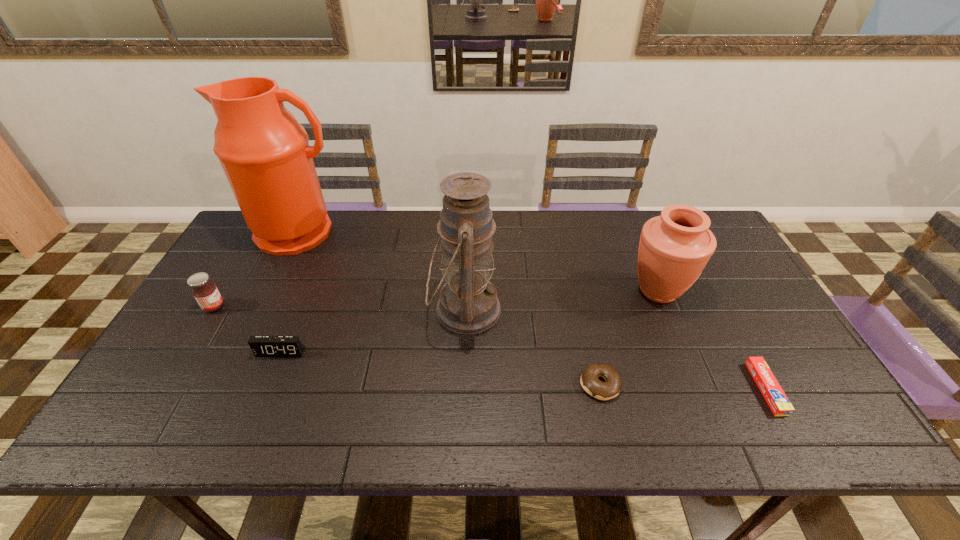
Where is `water jug located at the left edge`? water jug located at the left edge is located at coordinates (264, 152).

Find the location of a particular element. This screenshot has height=540, width=960. jam located in the left edge section of the desktop is located at coordinates (x=205, y=292).

The width and height of the screenshot is (960, 540). In order to click on object that is at the right edge in this screenshot , I will do `click(774, 395)`.

Find the location of a particular element. object located in the far left corner section of the desktop is located at coordinates (264, 152).

You are a GUI agent. You are given a task and a screenshot of the screen. Output one action in this format:
    pyautogui.click(x=<x>, y=<y>)
    Task: Click on the object that is at the near right corner
    The image size is (960, 540).
    Given the screenshot: What is the action you would take?
    pyautogui.click(x=774, y=395)

This screenshot has height=540, width=960. In the image, there is a desktop. Identify the location of vacant space at the far edge. (335, 218).

At what (x,y) coordinates should I click in order to perform the action: click on vacant space at the near edge of the desktop. Please return your answer as a coordinate pair (x, y). The height and width of the screenshot is (540, 960). Looking at the image, I should click on (363, 432).

Image resolution: width=960 pixels, height=540 pixels. In the image, there is a desktop. What are the coordinates of `vacant space at the right edge` in the screenshot? It's located at (771, 350).

Where is `free space between the oil lamp and the shortest object`? This screenshot has width=960, height=540. free space between the oil lamp and the shortest object is located at coordinates (615, 349).

Image resolution: width=960 pixels, height=540 pixels. In order to click on vacant area between the jam and the doughnut in this screenshot , I will do `click(407, 346)`.